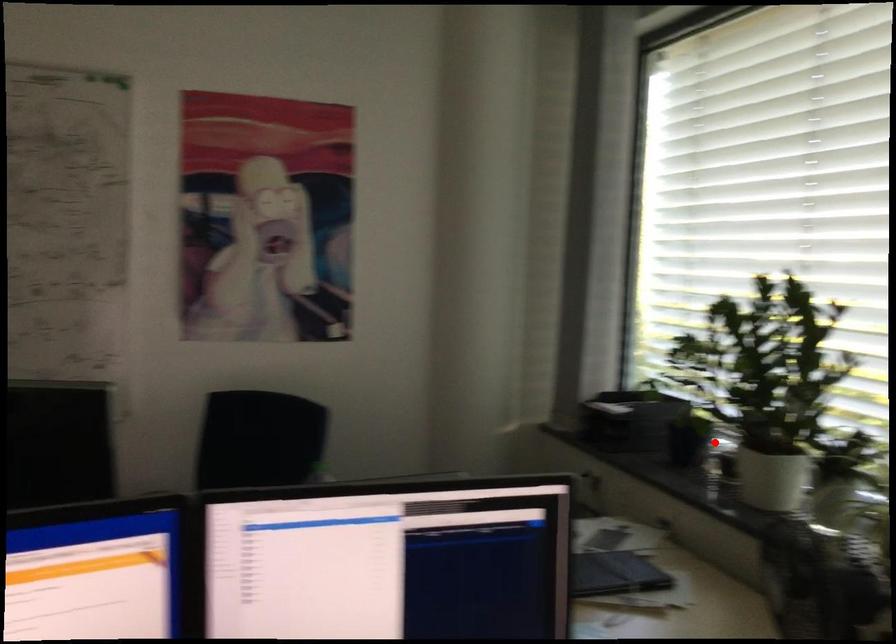
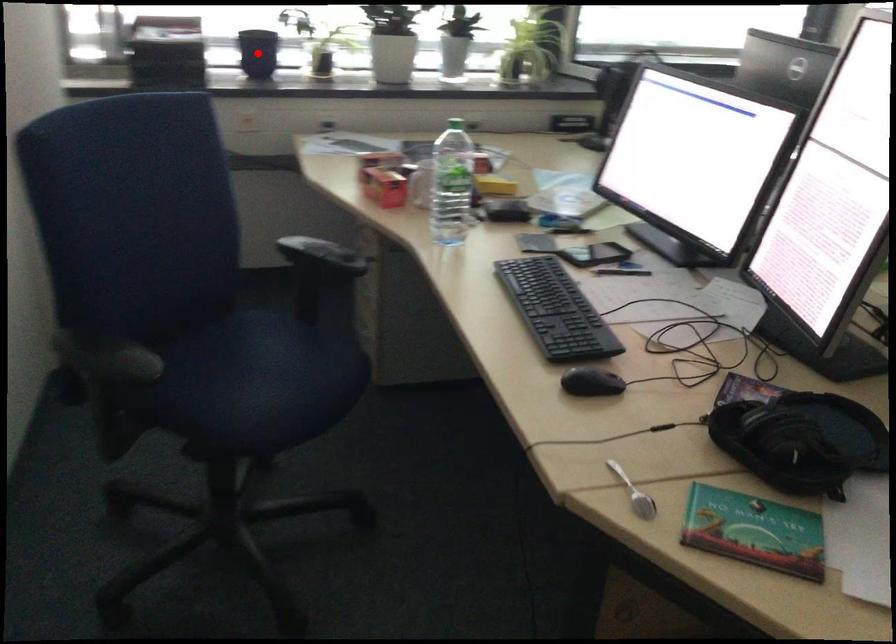
In the scene shown: I am providing you with two images of the same scene from different viewpoints. A red point is marked on the first image and another point is marked on the second image. Are the points marked in image1 and image2 representing the same 3D position?

Yes